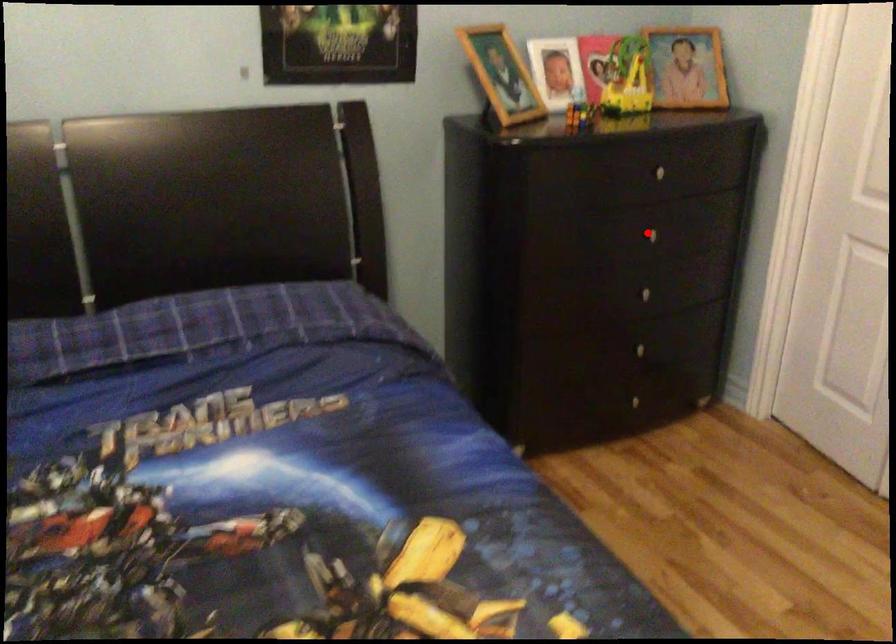
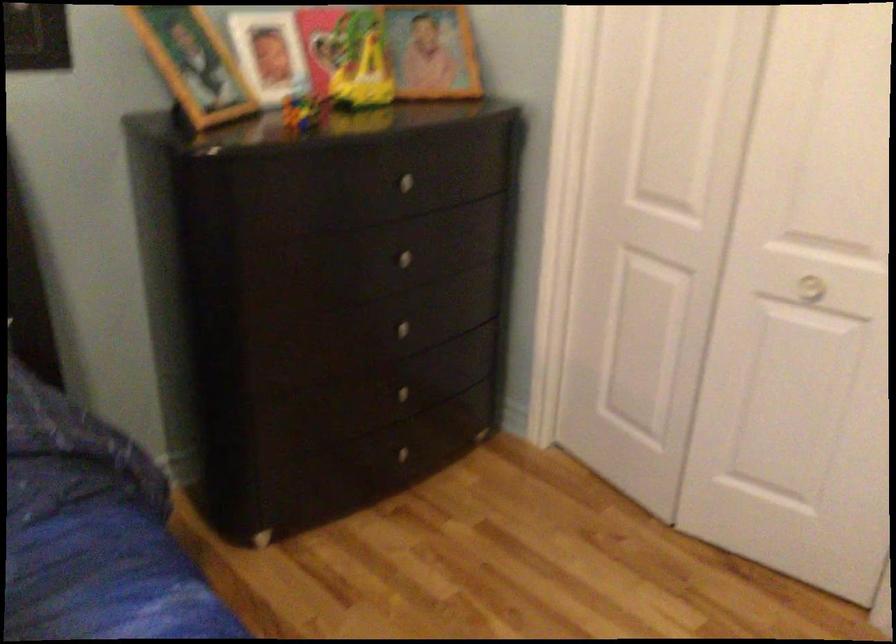
Question: I am providing you with two images of the same scene from different viewpoints. A red point is shown in image1. For the corresponding object point in image2, is it positioned nearer or farther from the camera?

Choices:
 (A) Nearer
 (B) Farther

Answer: (A)